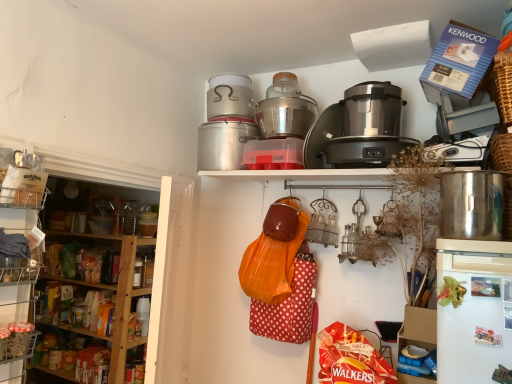
Question: Can you confirm if blue cardboard box at upper right, the 1th appliance positioned from the right, is positioned to the right of brushed metal rice cooker at upper center, which appears as the 1th rice cooker when viewed from the left?

Choices:
 (A) yes
 (B) no

Answer: (A)

Question: Are blue cardboard box at upper right, the 1th appliance positioned from the right, and brushed metal rice cooker at upper center, which ranks as the 3th rice cooker in right-to-left order, beside each other?

Choices:
 (A) yes
 (B) no

Answer: (B)

Question: From the image's perspective, is blue cardboard box at upper right, the 1th appliance positioned from the right, located above brushed metal rice cooker at upper center, which appears as the 1th rice cooker when viewed from the left?

Choices:
 (A) no
 (B) yes

Answer: (A)

Question: From a real-world perspective, is blue cardboard box at upper right, the 1th appliance positioned from the right, located beneath brushed metal rice cooker at upper center, which ranks as the 3th rice cooker in right-to-left order?

Choices:
 (A) no
 (B) yes

Answer: (B)

Question: Can you confirm if blue cardboard box at upper right, the 1th appliance positioned from the right, is bigger than brushed metal rice cooker at upper center, which appears as the 1th rice cooker when viewed from the left?

Choices:
 (A) yes
 (B) no

Answer: (A)

Question: Does blue cardboard box at upper right, marked as the 3th appliance in a left-to-right arrangement, appear on the left side of brushed metal rice cooker at upper center, which ranks as the 3th rice cooker in right-to-left order?

Choices:
 (A) yes
 (B) no

Answer: (B)

Question: Does silver metallic crock pot at upper center have a greater height compared to silver metallic rice cooker at upper center, which is the 2th rice cooker from right to left?

Choices:
 (A) yes
 (B) no

Answer: (A)

Question: From a real-world perspective, is silver metallic crock pot at upper center on top of silver metallic rice cooker at upper center, the 2th rice cooker when ordered from left to right?

Choices:
 (A) no
 (B) yes

Answer: (A)

Question: Considering the relative sizes of silver metallic crock pot at upper center and silver metallic rice cooker at upper center, which is the 2th rice cooker from right to left, in the image provided, is silver metallic crock pot at upper center thinner than silver metallic rice cooker at upper center, which is the 2th rice cooker from right to left,?

Choices:
 (A) no
 (B) yes

Answer: (B)

Question: Is silver metallic crock pot at upper center not close to silver metallic rice cooker at upper center, the 2th rice cooker when ordered from left to right?

Choices:
 (A) yes
 (B) no

Answer: (B)

Question: From a real-world perspective, is silver metallic crock pot at upper center located beneath silver metallic rice cooker at upper center, the 2th rice cooker when ordered from left to right?

Choices:
 (A) no
 (B) yes

Answer: (B)

Question: Is silver metallic crock pot at upper center facing towards silver metallic rice cooker at upper center, the 2th rice cooker when ordered from left to right?

Choices:
 (A) no
 (B) yes

Answer: (A)

Question: Is brushed metal rice cooker at upper center, which appears as the 1th rice cooker when viewed from the left, positioned with its back to blue cardboard box at upper right, marked as the 3th appliance in a left-to-right arrangement?

Choices:
 (A) no
 (B) yes

Answer: (A)